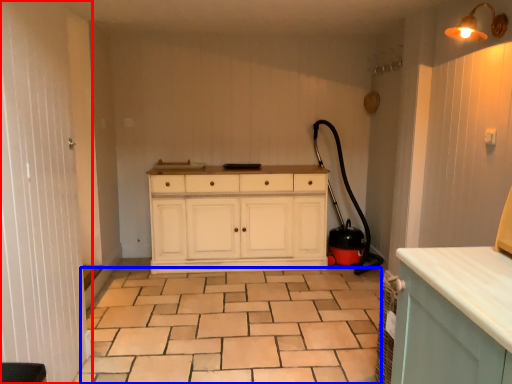
Question: Among these objects, which one is farthest to the camera, screen door (highlighted by a red box) or ceramic tile (highlighted by a blue box)?

Choices:
 (A) screen door
 (B) ceramic tile

Answer: (B)